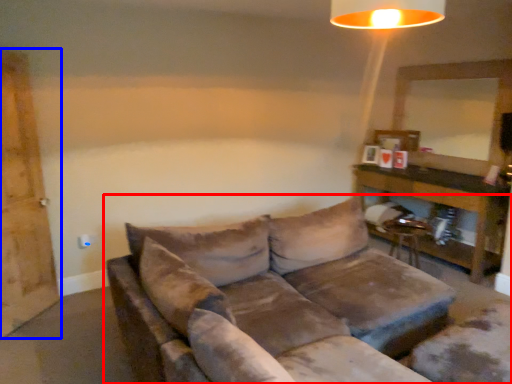
Question: Which object appears farthest to the camera in this image, studio couch (highlighted by a red box) or barn door (highlighted by a blue box)?

Choices:
 (A) studio couch
 (B) barn door

Answer: (B)